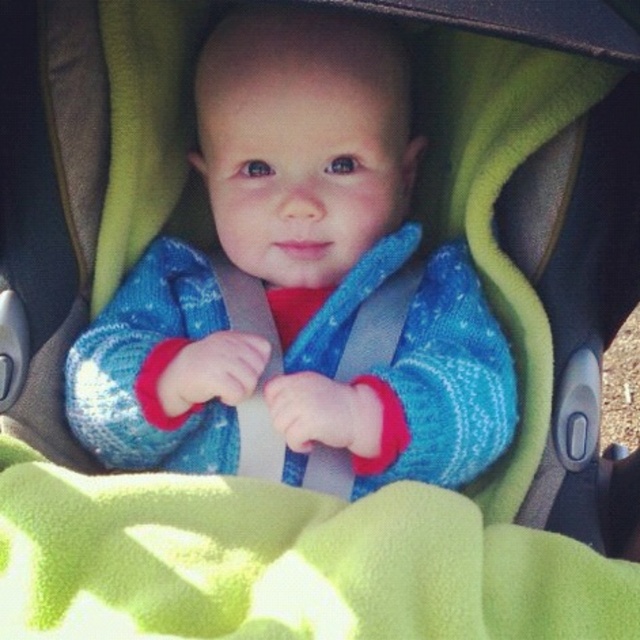
Question: Which of the following is the farthest from the observer?

Choices:
 (A) green fleece blanket at center
 (B) blue knitted sweater at center

Answer: (B)

Question: Which point is farther to the camera?

Choices:
 (A) green fleece blanket at center
 (B) blue knitted sweater at center

Answer: (B)

Question: Where is blue knitted sweater at center located in relation to green fleece blanket at center in the image?

Choices:
 (A) left
 (B) right

Answer: (A)

Question: Which of the following is the farthest from the observer?

Choices:
 (A) (253, 172)
 (B) (282, 563)

Answer: (A)

Question: Does blue knitted sweater at center have a smaller size compared to green fleece blanket at center?

Choices:
 (A) yes
 (B) no

Answer: (B)

Question: Can you confirm if blue knitted sweater at center is smaller than green fleece blanket at center?

Choices:
 (A) no
 (B) yes

Answer: (A)